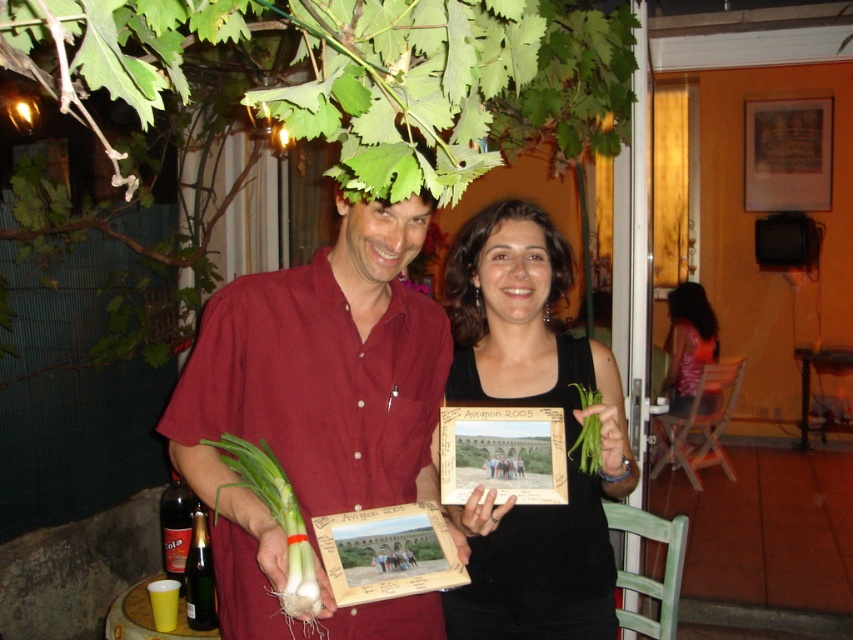
This screenshot has height=640, width=853. What do you see at coordinates (532, 406) in the screenshot? I see `black matte tank top at center` at bounding box center [532, 406].

Which of these two, black matte tank top at center or wooden photo frame at center, stands shorter?

wooden photo frame at center is shorter.

You are a GUI agent. You are given a task and a screenshot of the screen. Output one action in this format:
    pyautogui.click(x=<x>, y=<y>)
    Task: Click on the black matte tank top at center
    This screenshot has height=640, width=853.
    Given the screenshot: What is the action you would take?
    pyautogui.click(x=532, y=406)

Which of these two, matte pink blouse at center or green leafy vegetable at center, stands taller?

matte pink blouse at center

Between point (712, 401) and point (598, 396), which one is positioned behind?

Point (712, 401)

Identify the location of matte pink blouse at center. This screenshot has width=853, height=640. (688, 344).

Who is lower down, green leafy plant at upper center or matte red shirt at center?

Positioned lower is matte red shirt at center.

Does green leafy plant at upper center appear under matte red shirt at center?

Incorrect, green leafy plant at upper center is not positioned below matte red shirt at center.

The image size is (853, 640). I want to click on green leafy plant at upper center, so click(x=352, y=76).

At what (x,y) coordinates should I click in order to perform the action: click on green leafy plant at upper center. Please return your answer as a coordinate pair (x, y). The width and height of the screenshot is (853, 640). Looking at the image, I should click on (352, 76).